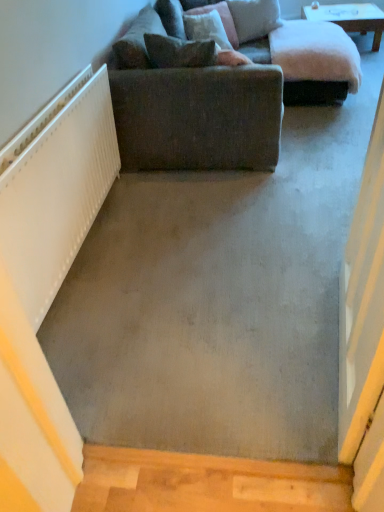
Question: In which direction should I rotate to look at velvet pink pillow at upper center, arranged as the 3th pillow when viewed from the back?

Choices:
 (A) right
 (B) left

Answer: (A)

Question: From the image's perspective, is velvet pink pillow at upper center, positioned as the 2th pillow in front-to-back order, over velvet brown pillow at upper center, which ranks as the 3th pillow in front-to-back order?

Choices:
 (A) no
 (B) yes

Answer: (A)

Question: Is velvet pink pillow at upper center, positioned as the 2th pillow in front-to-back order, in contact with velvet brown pillow at upper center, which appears as the 2th pillow when viewed from the back?

Choices:
 (A) yes
 (B) no

Answer: (A)

Question: Is velvet pink pillow at upper center, arranged as the 3th pillow when viewed from the back, far from velvet brown pillow at upper center, which ranks as the 3th pillow in front-to-back order?

Choices:
 (A) yes
 (B) no

Answer: (B)

Question: Can you confirm if velvet pink pillow at upper center, positioned as the 2th pillow in front-to-back order, is smaller than velvet brown pillow at upper center, which appears as the 2th pillow when viewed from the back?

Choices:
 (A) no
 (B) yes

Answer: (A)

Question: Is velvet pink pillow at upper center, arranged as the 3th pillow when viewed from the back, completely or partially outside of velvet brown pillow at upper center, which ranks as the 3th pillow in front-to-back order?

Choices:
 (A) yes
 (B) no

Answer: (A)

Question: From the image's perspective, would you say velvet pink pillow at upper center, arranged as the 3th pillow when viewed from the back, is shown under velvet brown pillow at upper center, which appears as the 2th pillow when viewed from the back?

Choices:
 (A) yes
 (B) no

Answer: (A)

Question: From the image's perspective, would you say velvet pink pillow at upper center, arranged as the 3th pillow when viewed from the back, is shown under brown fabric pillow at upper center, marked as the first pillow in a front-to-back arrangement?

Choices:
 (A) no
 (B) yes

Answer: (A)

Question: Is velvet pink pillow at upper center, positioned as the 2th pillow in front-to-back order, completely or partially outside of brown fabric pillow at upper center, marked as the first pillow in a front-to-back arrangement?

Choices:
 (A) no
 (B) yes

Answer: (B)

Question: From the image's perspective, is velvet pink pillow at upper center, arranged as the 3th pillow when viewed from the back, on top of brown fabric pillow at upper center, marked as the first pillow in a front-to-back arrangement?

Choices:
 (A) yes
 (B) no

Answer: (A)

Question: Is velvet pink pillow at upper center, positioned as the 2th pillow in front-to-back order, in front of brown fabric pillow at upper center, arranged as the fourth pillow when viewed from the back?

Choices:
 (A) yes
 (B) no

Answer: (B)

Question: Is velvet pink pillow at upper center, arranged as the 3th pillow when viewed from the back, looking in the opposite direction of brown fabric pillow at upper center, marked as the first pillow in a front-to-back arrangement?

Choices:
 (A) yes
 (B) no

Answer: (B)

Question: Is velvet pink pillow at upper center, arranged as the 3th pillow when viewed from the back, oriented towards brown fabric pillow at upper center, marked as the first pillow in a front-to-back arrangement?

Choices:
 (A) no
 (B) yes

Answer: (A)

Question: From a real-world perspective, is brown fabric pillow at upper center, marked as the first pillow in a front-to-back arrangement, located beneath white glossy table at upper center?

Choices:
 (A) yes
 (B) no

Answer: (B)